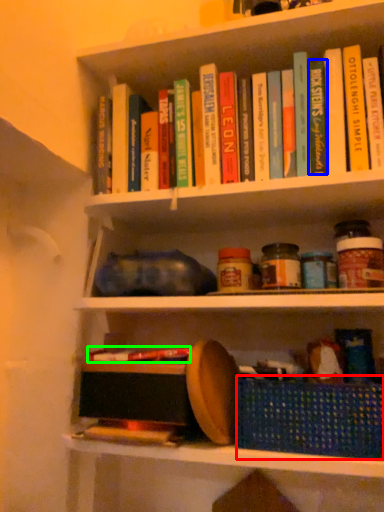
Question: Which is nearer to the basket (highlighted by a red box)? paperback book (highlighted by a blue box) or book (highlighted by a green box).

Choices:
 (A) paperback book
 (B) book

Answer: (B)